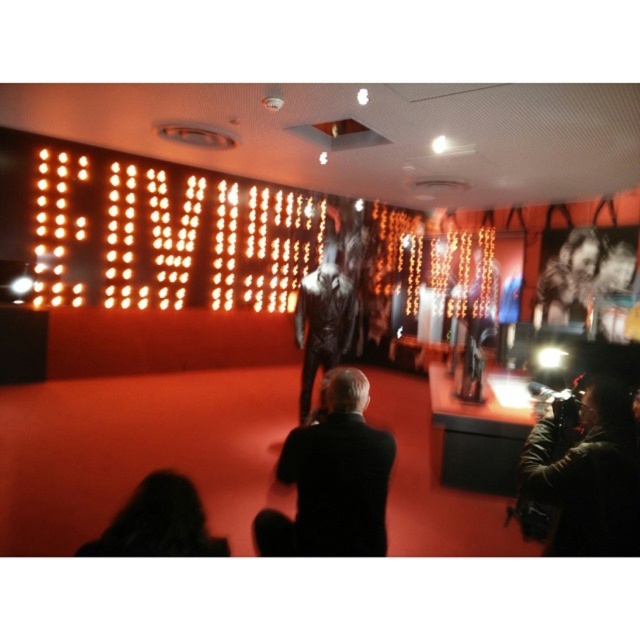
You are a photographer at the event and need to move from the dark brown leather jacket at lower right to the shiny metallic suit at center to adjust your shot. Can you walk directly between them without needing to detour around any obstacles?

The dark brown leather jacket at lower right and shiny metallic suit at center are 2.71 meters apart, so there is enough space for you to walk directly between them without needing to detour around any obstacles.

You are standing at the entrance of the event and want to take a photo of both the dark brown leather jacket at lower right and the shiny metallic suit at center. Which object should you frame first in your camera viewfinder to ensure both are in the shot?

You should frame the shiny metallic suit at center first because the dark brown leather jacket at lower right is to the right of it, so positioning the camera to include both would require starting from the center and expanding to the right.

You are standing at the center of the room and want to walk towards the point marked at coordinates (582, 476). Which object will you encounter first?

The point at (582, 476) is on the dark brown leather jacket at lower right, so you will encounter the dark brown leather jacket at lower right first when walking towards that point from the center of the room.